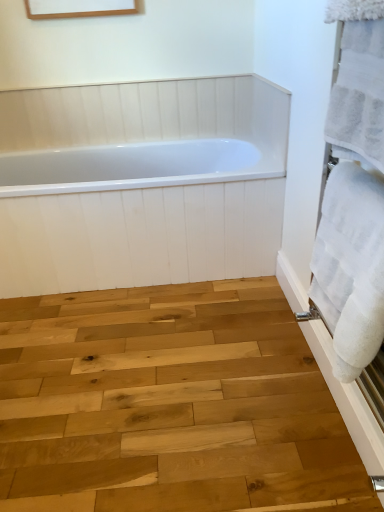
This screenshot has width=384, height=512. I want to click on free point above natural wood plank at center (from a real-world perspective), so click(x=125, y=412).